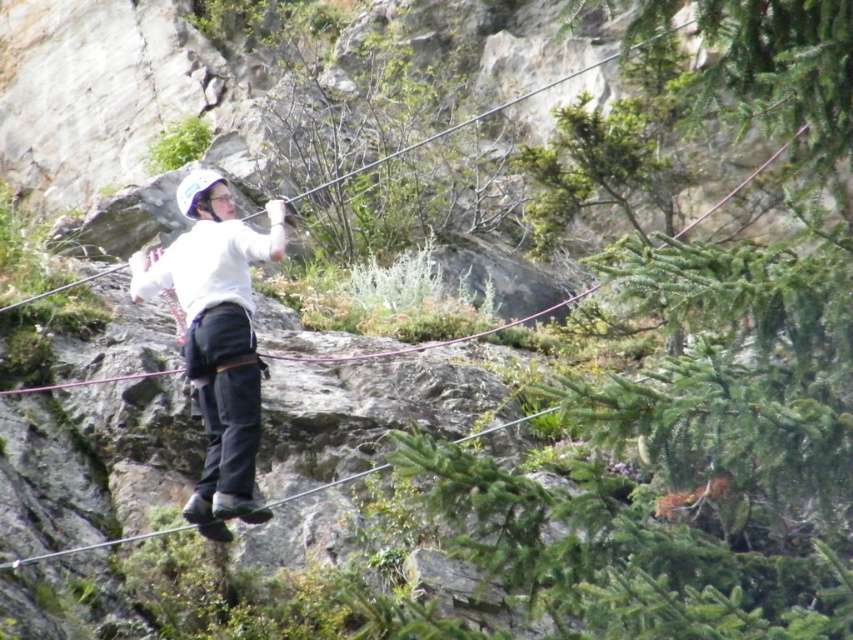
Question: Which point appears closest to the camera in this image?

Choices:
 (A) (834, 70)
 (B) (213, 364)

Answer: (A)

Question: Can you confirm if green leafy tree at center is thinner than white matte helmet at center?

Choices:
 (A) yes
 (B) no

Answer: (B)

Question: Which object appears farthest from the camera in this image?

Choices:
 (A) green leafy tree at center
 (B) white matte helmet at center

Answer: (B)

Question: Can you confirm if green leafy tree at center is positioned above white matte helmet at center?

Choices:
 (A) yes
 (B) no

Answer: (B)

Question: Is green leafy tree at center above white matte helmet at center?

Choices:
 (A) yes
 (B) no

Answer: (B)